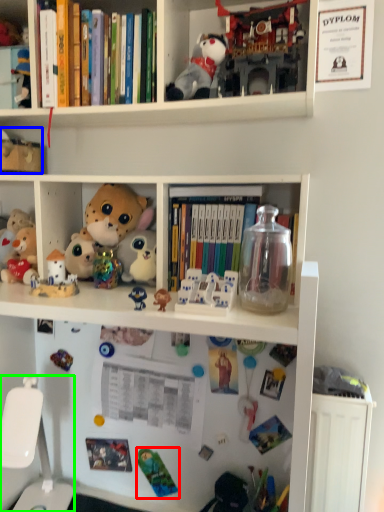
Question: Based on their relative distances, which object is nearer to toy (highlighted by a red box)? Choose from toy (highlighted by a blue box) and swivel chair (highlighted by a green box).

Choices:
 (A) toy
 (B) swivel chair

Answer: (B)